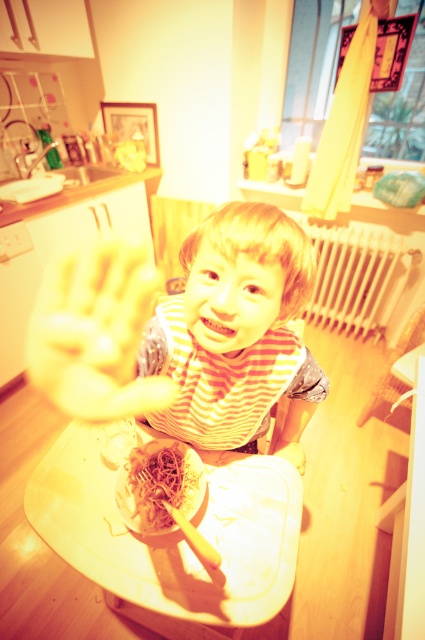
Question: Observing the image, what is the correct spatial positioning of striped fabric toddler at center in reference to white plastic tray at lower center?

Choices:
 (A) right
 (B) left

Answer: (B)

Question: Does striped fabric toddler at center have a larger size compared to yellow matte hand at center?

Choices:
 (A) no
 (B) yes

Answer: (A)

Question: Considering the real-world distances, which object is farthest from the yellowish matte noodles at lower center?

Choices:
 (A) yellow matte hand at center
 (B) striped fabric toddler at center
 (C) white plastic tray at lower center

Answer: (B)

Question: Which object appears closest to the camera in this image?

Choices:
 (A) yellowish matte noodles at lower center
 (B) white plastic tray at lower center

Answer: (B)

Question: Does white plastic tray at lower center appear over yellow matte hand at center?

Choices:
 (A) no
 (B) yes

Answer: (A)

Question: Which point is farther to the camera?

Choices:
 (A) (210, 496)
 (B) (48, 362)
 (C) (65, 312)

Answer: (C)